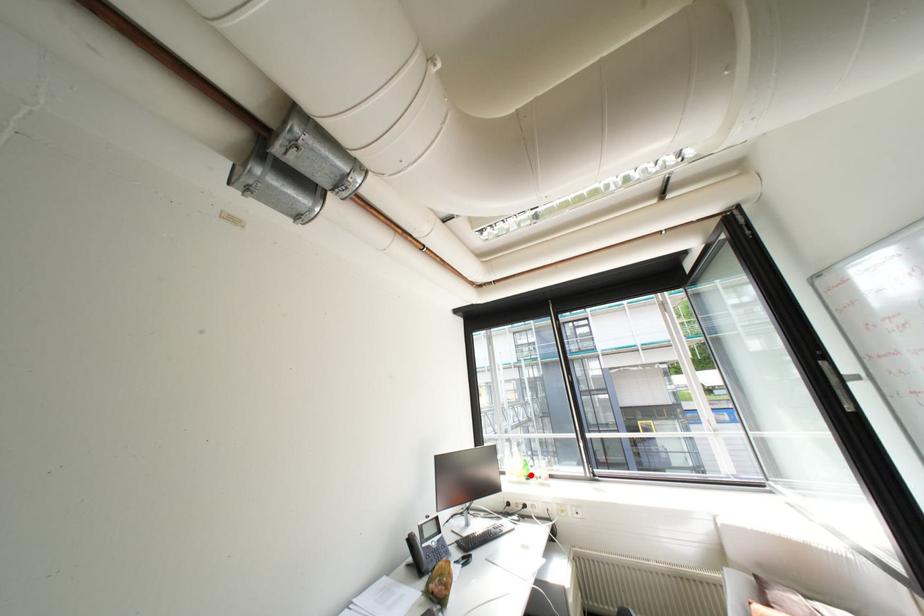
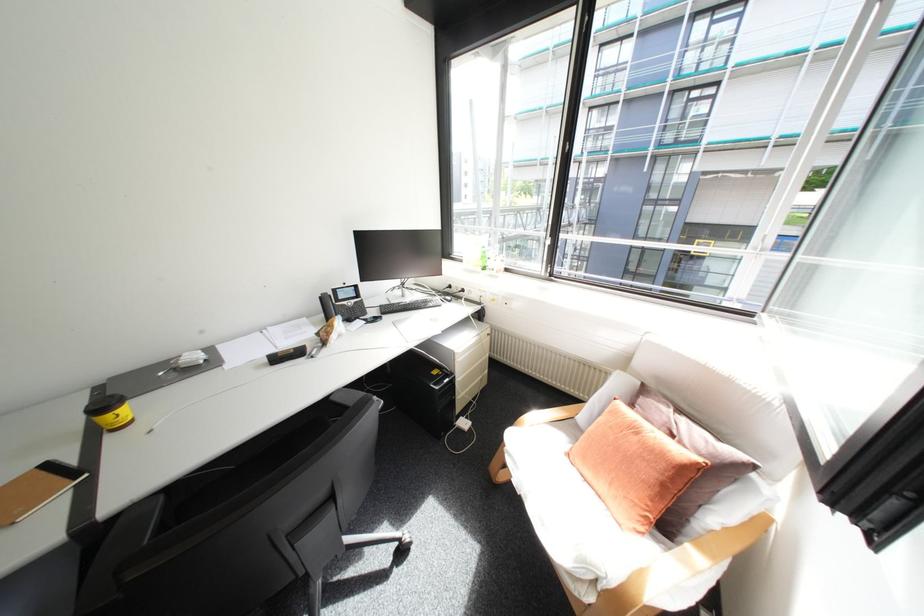
Question: I am providing you with two images of the same scene from different viewpoints. A red point is shown in image1. For the corresponding object point in image2, is it positioned nearer or farther from the camera?

Choices:
 (A) Nearer
 (B) Farther

Answer: (A)